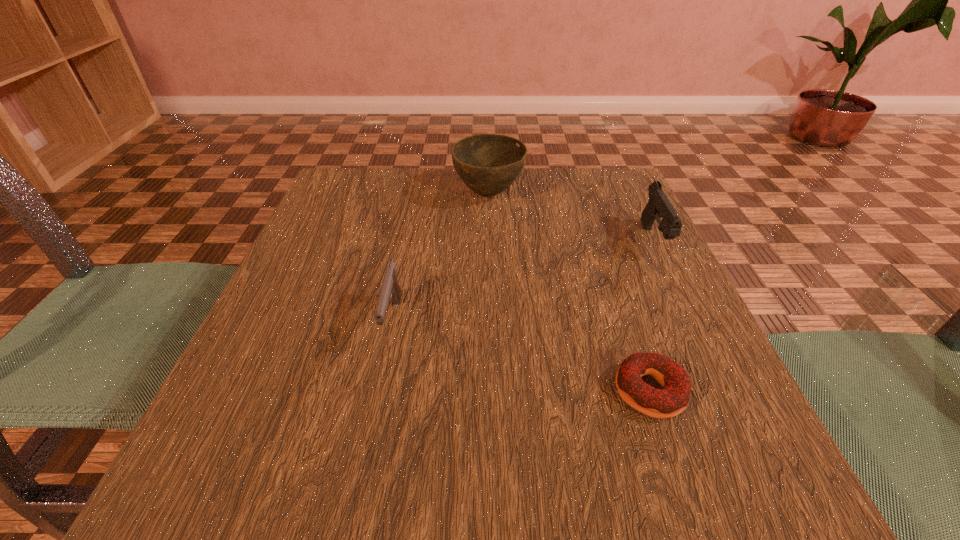
This screenshot has height=540, width=960. In the image, there is a desktop. Find the location of `vacant area at the right edge`. vacant area at the right edge is located at coordinates (594, 268).

Where is `free space at the far left corner of the desktop`? free space at the far left corner of the desktop is located at coordinates (378, 211).

Image resolution: width=960 pixels, height=540 pixels. I want to click on free spot between the farthest object and the taller pistol, so click(x=571, y=218).

Where is `vacant area that lies between the right pistol and the second shortest object`? The image size is (960, 540). vacant area that lies between the right pistol and the second shortest object is located at coordinates (523, 281).

You are a GUI agent. You are given a task and a screenshot of the screen. Output one action in this format:
    pyautogui.click(x=<x>, y=<y>)
    Task: Click on the vacant space in between the right pistol and the second object from left to right
    
    Given the screenshot: What is the action you would take?
    pyautogui.click(x=571, y=218)

Identify the location of vacant space in between the bowl and the rightmost object. The width and height of the screenshot is (960, 540). [571, 218].

What are the coordinates of `free space between the farthest object and the third tallest object` in the screenshot? It's located at (441, 258).

Image resolution: width=960 pixels, height=540 pixels. I want to click on vacant region between the second farthest object and the nearer pistol, so coord(523,281).

The width and height of the screenshot is (960, 540). I want to click on free space that is in between the bowl and the second farthest object, so click(x=571, y=218).

You are a GUI agent. You are given a task and a screenshot of the screen. Output one action in this format:
    pyautogui.click(x=<x>, y=<y>)
    Task: Click on the unoccupied area between the bowl and the shortest object
    The height and width of the screenshot is (540, 960).
    Given the screenshot: What is the action you would take?
    pyautogui.click(x=569, y=293)